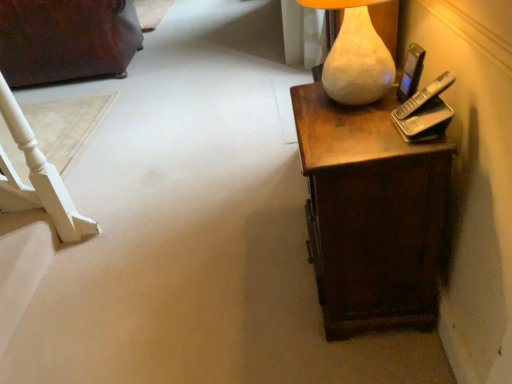
Question: Is dark brown wood dresser at upper left completely or partially outside of black plastic mobile phone at upper right?

Choices:
 (A) no
 (B) yes

Answer: (B)

Question: Would you say dark brown wood dresser at upper left contains black plastic mobile phone at upper right?

Choices:
 (A) yes
 (B) no

Answer: (B)

Question: Can you confirm if dark brown wood dresser at upper left is thinner than black plastic mobile phone at upper right?

Choices:
 (A) yes
 (B) no

Answer: (B)

Question: Is dark brown wood dresser at upper left to the right of black plastic mobile phone at upper right from the viewer's perspective?

Choices:
 (A) no
 (B) yes

Answer: (A)

Question: Can you confirm if dark brown wood dresser at upper left is taller than black plastic mobile phone at upper right?

Choices:
 (A) yes
 (B) no

Answer: (A)

Question: Could you tell me if dark brown wood dresser at upper left is turned towards black plastic mobile phone at upper right?

Choices:
 (A) no
 (B) yes

Answer: (A)

Question: Is black plastic mobile phone at upper right to the right of matte white lamp at upper right from the viewer's perspective?

Choices:
 (A) yes
 (B) no

Answer: (A)

Question: From a real-world perspective, is black plastic mobile phone at upper right under matte white lamp at upper right?

Choices:
 (A) no
 (B) yes

Answer: (B)

Question: Does black plastic mobile phone at upper right have a lesser width compared to matte white lamp at upper right?

Choices:
 (A) yes
 (B) no

Answer: (A)

Question: Does black plastic mobile phone at upper right lie behind matte white lamp at upper right?

Choices:
 (A) no
 (B) yes

Answer: (B)

Question: Does black plastic mobile phone at upper right have a lesser height compared to matte white lamp at upper right?

Choices:
 (A) no
 (B) yes

Answer: (B)

Question: Is black plastic mobile phone at upper right taller than matte white lamp at upper right?

Choices:
 (A) no
 (B) yes

Answer: (A)

Question: From the image's perspective, is matte white lamp at upper right located beneath brown wood desk at right?

Choices:
 (A) yes
 (B) no

Answer: (B)